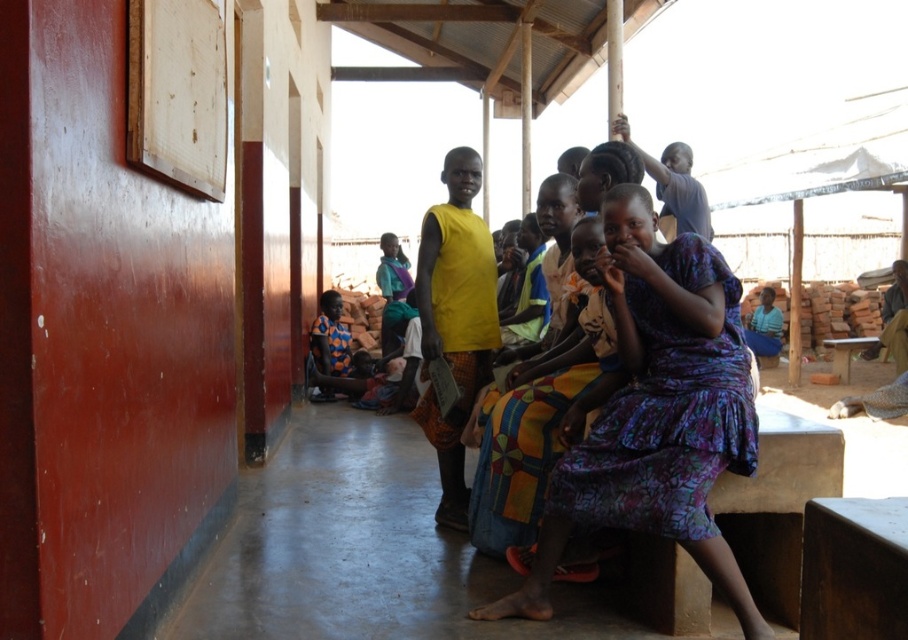
You are standing in front of the shelter and want to place a small plant between the two points, point (522, 595) and point (512, 467). Which point should the plant be closer to if you want it to be nearer to the woman in the purple dress?

The plant should be placed closer to point (522, 595) because it is closer to the viewer, meaning it will be nearer to the woman in the purple dress who is also at the foreground.

Please look at the coordinates provided. Which object is located at point (656, 413)?

The purple floral dress at center is located at point (656, 413).

You are standing at the entrance of the shelter and want to greet the person wearing the purple floral dress at center. In which direction should you walk to reach them?

The purple floral dress at center is located at point 0.647 on the x axis and 0.724 on the y axis. Since the coordinate system is normalized, you should walk towards the center area of the shelter to reach the purple floral dress at center.